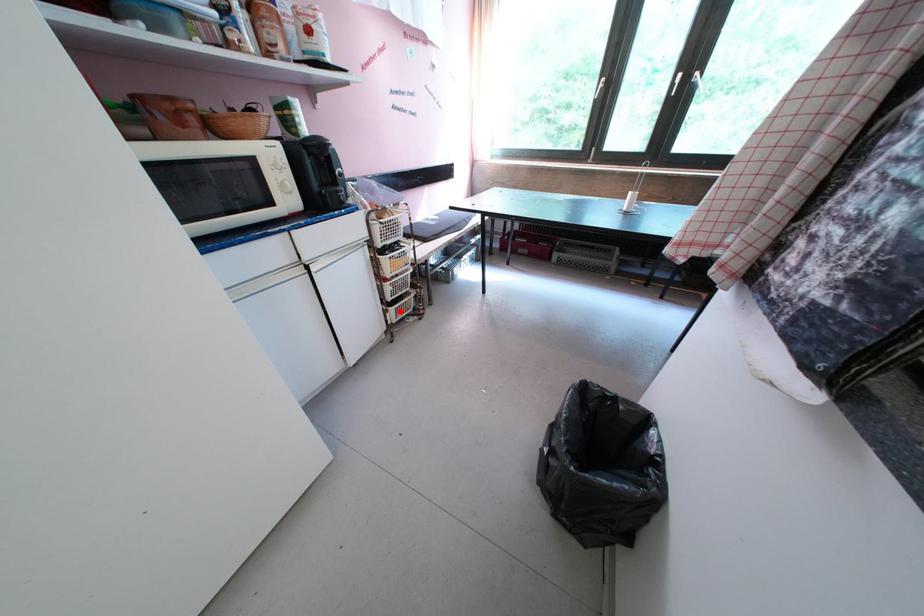
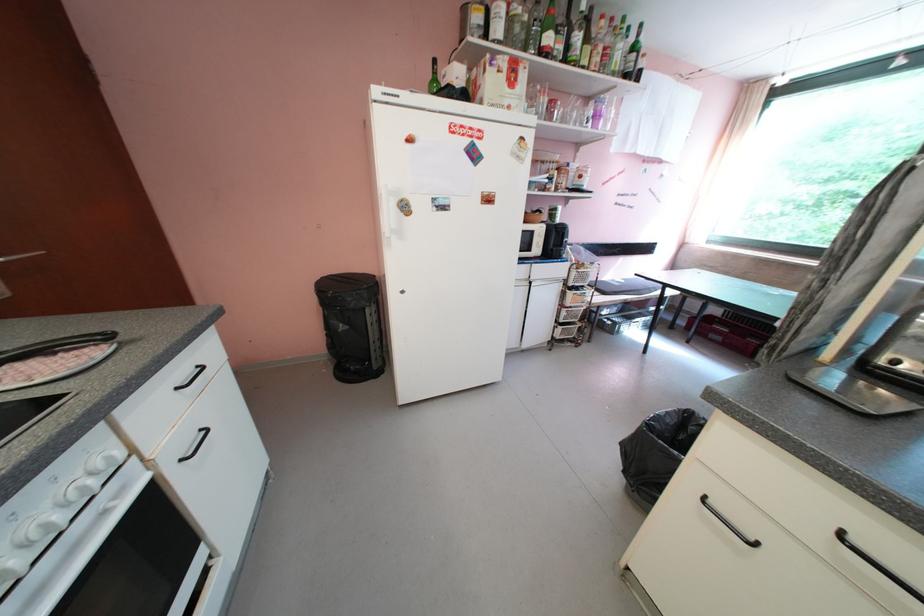
Question: I am providing you with two images of the same scene from different viewpoints. Given a red point in image1, look at the same physical point in image2. Is it:

Choices:
 (A) Closer to the viewpoint
 (B) Farther from the viewpoint

Answer: (B)